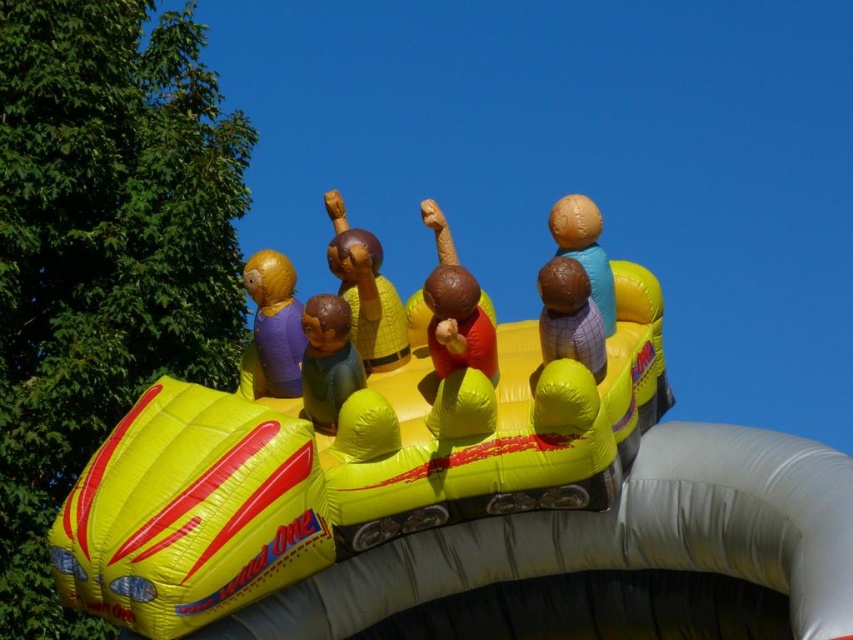
You are a child standing at the entrance of the yellow race car ride. You see the yellow matte figure at center and the matte brown ball at center inside the car. Which object is closer to the left side of the car?

The yellow matte figure at center is closer to the left side of the car because it is positioned to the left of the matte brown ball at center.

You are planning to place a new small toy on the inflatable race car ride. The toy requires a space that is wider than the yellow matte figure at center. Can the matte brown ball at center provide enough space for the toy?

The yellow matte figure at center might be wider than the matte brown ball at center, so it is uncertain if the matte brown ball at center can provide enough space for the toy.

You are a visitor standing in front of the inflatable race car ride. You notice two items inside the car, the matte yellow figure at center and the matte brown ball at center. Which one is closer to you?

The matte yellow figure at center is closer to you because it is further to the viewer than the matte brown ball at center.